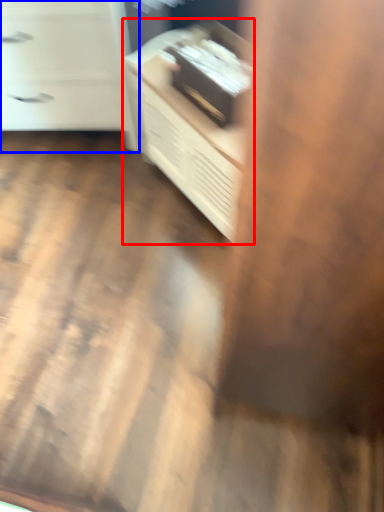
Question: Which object is further to the camera taking this photo, furniture (highlighted by a red box) or chest of drawers (highlighted by a blue box)?

Choices:
 (A) furniture
 (B) chest of drawers

Answer: (B)